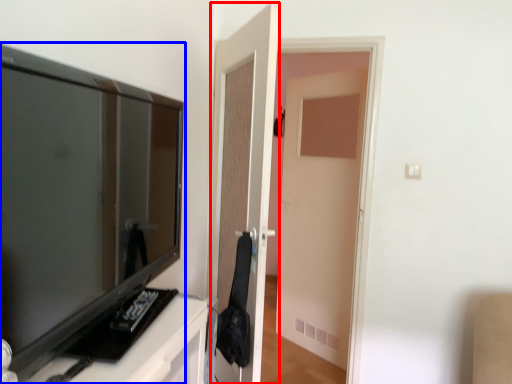
Question: Which object is closer to the camera taking this photo, door (highlighted by a red box) or television (highlighted by a blue box)?

Choices:
 (A) door
 (B) television

Answer: (B)